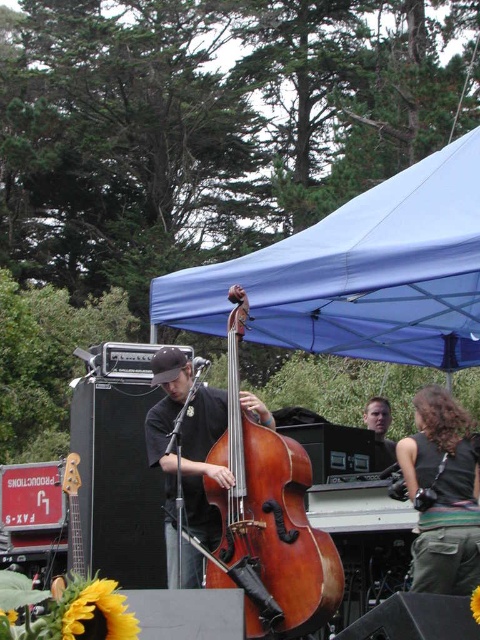
You are a stagehand setting up for an outdoor concert. You need to ensure that the blue fabric canopy at upper center can cover the brown wooden bass at center completely. Based on the scene description, will the canopy be large enough?

The blue fabric canopy at upper center is larger in size than brown wooden bass at center, so yes, the canopy will be large enough to cover the brown wooden bass at center completely.

You are a photographer trying to capture the blue fabric canopy at upper center and the brown wooden bass at center in a single shot. Which object should you focus on first if you want to ensure both are in sharp focus?

The blue fabric canopy at upper center is closer to the viewer than the brown wooden bass at center, so focusing on the canopy first will ensure both are in focus due to the depth of field extending from the closer object to the farther one.

You are a photographer positioned at the center of the scene. You want to take a photo of the shiny brown wood cello at center. Where should you point your camera to capture the cello in the frame?

The shiny brown wood cello at center is located at point coordinates of (267, 518). Therefore, you should aim your camera towards those coordinates to capture the cello in the frame.